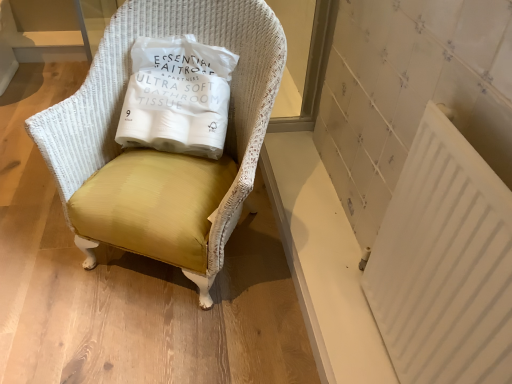
Question: Considering the relative positions of white plastic radiator at lower right and matte yellow fabric chair at center in the image provided, is white plastic radiator at lower right to the right of matte yellow fabric chair at center from the viewer's perspective?

Choices:
 (A) no
 (B) yes

Answer: (B)

Question: Is matte yellow fabric chair at center inside white plastic radiator at lower right?

Choices:
 (A) yes
 (B) no

Answer: (B)

Question: Is white plastic radiator at lower right turned away from matte yellow fabric chair at center?

Choices:
 (A) no
 (B) yes

Answer: (A)

Question: Are white plastic radiator at lower right and matte yellow fabric chair at center far apart?

Choices:
 (A) no
 (B) yes

Answer: (A)

Question: From a real-world perspective, is white plastic radiator at lower right under matte yellow fabric chair at center?

Choices:
 (A) no
 (B) yes

Answer: (A)

Question: From the image's perspective, is matte yellow fabric chair at center positioned above or below white plastic radiator at lower right?

Choices:
 (A) above
 (B) below

Answer: (A)

Question: In terms of size, does matte yellow fabric chair at center appear bigger or smaller than white plastic radiator at lower right?

Choices:
 (A) big
 (B) small

Answer: (A)

Question: Is matte yellow fabric chair at center inside or outside of white plastic radiator at lower right?

Choices:
 (A) outside
 (B) inside

Answer: (A)

Question: Relative to white plastic radiator at lower right, is matte yellow fabric chair at center in front or behind?

Choices:
 (A) front
 (B) behind

Answer: (B)

Question: In terms of size, does matte yellow fabric chair at center appear bigger or smaller than white paper bag at center?

Choices:
 (A) small
 (B) big

Answer: (B)

Question: Relative to white paper bag at center, is matte yellow fabric chair at center in front or behind?

Choices:
 (A) behind
 (B) front

Answer: (B)

Question: Based on their positions, is matte yellow fabric chair at center located to the left or right of white paper bag at center?

Choices:
 (A) left
 (B) right

Answer: (A)

Question: Is point (246, 175) positioned closer to the camera than point (223, 102)?

Choices:
 (A) farther
 (B) closer

Answer: (B)

Question: Is white plastic radiator at lower right situated inside matte yellow fabric chair at center or outside?

Choices:
 (A) inside
 (B) outside

Answer: (B)

Question: Is point pos(442,377) positioned closer to the camera than point pos(72,185)?

Choices:
 (A) closer
 (B) farther

Answer: (A)